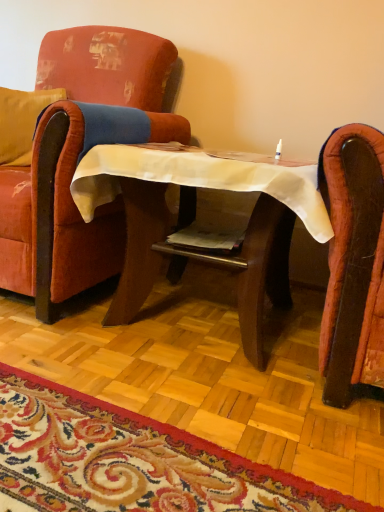
Question: From the image's perspective, is wooden table at center on velvet red armchair at left?

Choices:
 (A) yes
 (B) no

Answer: (B)

Question: Is wooden table at center smaller than velvet red armchair at left?

Choices:
 (A) no
 (B) yes

Answer: (B)

Question: Considering the relative positions of wooden table at center and velvet red armchair at left in the image provided, is wooden table at center behind velvet red armchair at left?

Choices:
 (A) yes
 (B) no

Answer: (B)

Question: From a real-world perspective, does wooden table at center stand above velvet red armchair at left?

Choices:
 (A) no
 (B) yes

Answer: (A)

Question: Can you confirm if wooden table at center is taller than velvet red armchair at left?

Choices:
 (A) no
 (B) yes

Answer: (A)

Question: From the image's perspective, is wooden table at center above or below velvet yellow pillow at left?

Choices:
 (A) below
 (B) above

Answer: (A)

Question: In the image, is wooden table at center positioned in front of or behind velvet yellow pillow at left?

Choices:
 (A) front
 (B) behind

Answer: (A)

Question: Is wooden table at center bigger or smaller than velvet yellow pillow at left?

Choices:
 (A) big
 (B) small

Answer: (A)

Question: Considering the relative positions of wooden table at center and velvet yellow pillow at left in the image provided, is wooden table at center to the left or to the right of velvet yellow pillow at left?

Choices:
 (A) right
 (B) left

Answer: (A)

Question: Is point (26, 269) positioned closer to the camera than point (284, 231)?

Choices:
 (A) farther
 (B) closer

Answer: (B)

Question: From a real-world perspective, is velvet red armchair at left physically located above or below wooden table at center?

Choices:
 (A) below
 (B) above

Answer: (B)

Question: From the image's perspective, relative to wooden table at center, is velvet red armchair at left above or below?

Choices:
 (A) below
 (B) above

Answer: (B)

Question: Is velvet red armchair at left inside the boundaries of wooden table at center, or outside?

Choices:
 (A) outside
 (B) inside

Answer: (A)

Question: From a real-world perspective, is carpet with floral pattern at lower center above or below velvet red armchair at left?

Choices:
 (A) below
 (B) above

Answer: (A)

Question: Considering their positions, is carpet with floral pattern at lower center located in front of or behind velvet red armchair at left?

Choices:
 (A) front
 (B) behind

Answer: (A)